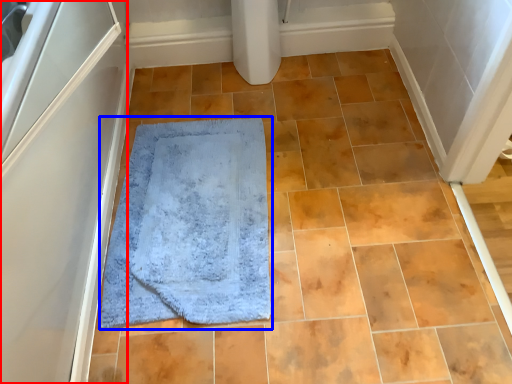
Question: Among these objects, which one is nearest to the camera, screen door (highlighted by a red box) or bath mat (highlighted by a blue box)?

Choices:
 (A) screen door
 (B) bath mat

Answer: (A)